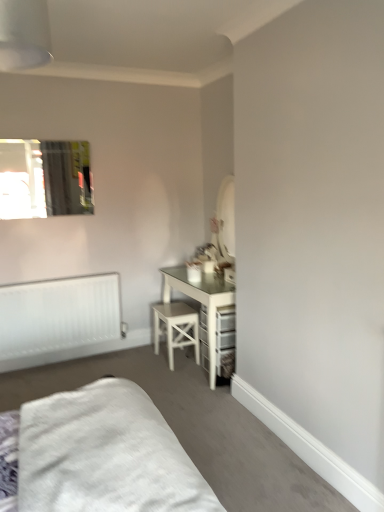
Question: Is white soft bed at lower left at the back of white wood stool at center?

Choices:
 (A) no
 (B) yes

Answer: (A)

Question: Is white wood stool at center outside white soft bed at lower left?

Choices:
 (A) no
 (B) yes

Answer: (B)

Question: Is white wood stool at center in front of white soft bed at lower left?

Choices:
 (A) yes
 (B) no

Answer: (B)

Question: Is white wood stool at center at the left side of white soft bed at lower left?

Choices:
 (A) yes
 (B) no

Answer: (B)

Question: Considering the relative sizes of white wood stool at center and white soft bed at lower left in the image provided, is white wood stool at center taller than white soft bed at lower left?

Choices:
 (A) yes
 (B) no

Answer: (A)

Question: Can you confirm if white wood stool at center is thinner than white soft bed at lower left?

Choices:
 (A) no
 (B) yes

Answer: (B)

Question: From a real-world perspective, is white wood stool at center positioned under clear glass mirror at upper left based on gravity?

Choices:
 (A) yes
 (B) no

Answer: (A)

Question: Is white wood stool at center far from clear glass mirror at upper left?

Choices:
 (A) yes
 (B) no

Answer: (A)

Question: Is white wood stool at center smaller than clear glass mirror at upper left?

Choices:
 (A) yes
 (B) no

Answer: (B)

Question: From the image's perspective, is white wood stool at center above clear glass mirror at upper left?

Choices:
 (A) yes
 (B) no

Answer: (B)

Question: Can you confirm if white wood stool at center is thinner than clear glass mirror at upper left?

Choices:
 (A) yes
 (B) no

Answer: (B)

Question: Can you confirm if white wood stool at center is bigger than clear glass mirror at upper left?

Choices:
 (A) yes
 (B) no

Answer: (A)

Question: Can you confirm if white soft bed at lower left is positioned to the right of white matte radiator at lower left?

Choices:
 (A) yes
 (B) no

Answer: (A)